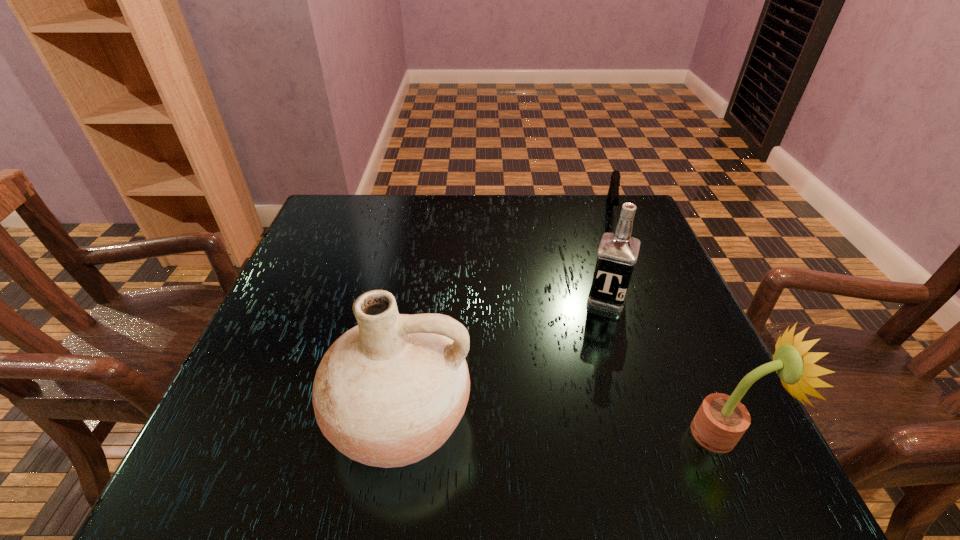
Identify the location of free space located on the front-facing side of the pistol. (614, 294).

Where is `vacant space located on the front-facing side of the pistol`? vacant space located on the front-facing side of the pistol is located at coordinates (614, 254).

Identify the location of object at the far edge. (613, 193).

This screenshot has width=960, height=540. What are the coordinates of `pottery positioned at the near edge` in the screenshot? It's located at (389, 392).

At what (x,y) coordinates should I click in order to perform the action: click on sunflower that is at the near edge. Please return your answer as a coordinate pair (x, y). Looking at the image, I should click on (720, 422).

At what (x,y) coordinates should I click in order to perform the action: click on sunflower that is at the right edge. Please return your answer as a coordinate pair (x, y). The height and width of the screenshot is (540, 960). Looking at the image, I should click on (720, 422).

At what (x,y) coordinates should I click in order to perform the action: click on vodka that is at the right edge. Please return your answer as a coordinate pair (x, y). Looking at the image, I should click on (617, 254).

Where is `pistol present at the right edge`? This screenshot has height=540, width=960. pistol present at the right edge is located at coordinates (613, 193).

Locate an element on the screen. The height and width of the screenshot is (540, 960). object at the far right corner is located at coordinates [613, 193].

Identify the location of object that is at the near right corner. (720, 422).